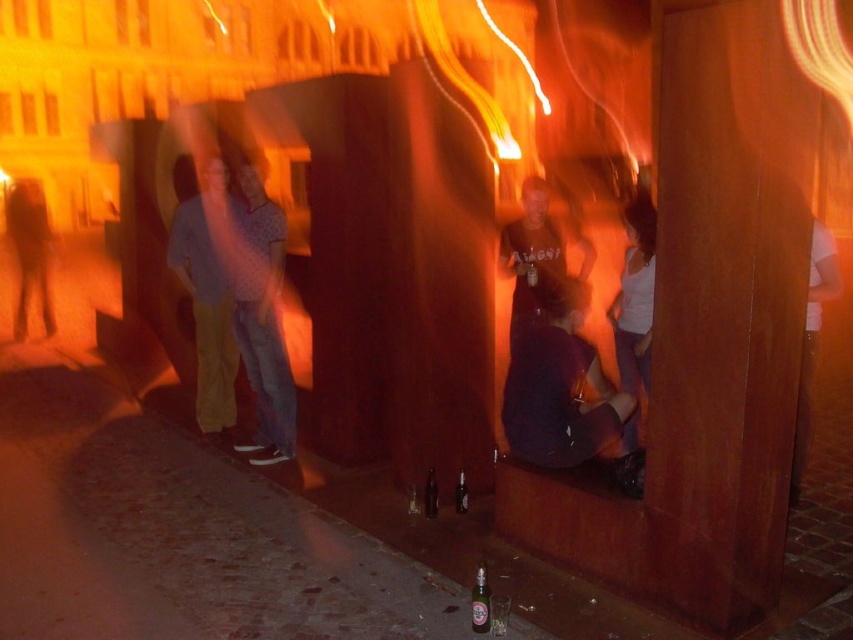
Consider the image. Who is more forward, (x=618, y=358) or (x=430, y=496)?

Point (x=430, y=496)

The image size is (853, 640). What do you see at coordinates (635, 298) in the screenshot? I see `white cotton tank top at center` at bounding box center [635, 298].

Where is `white cotton tank top at center`? Image resolution: width=853 pixels, height=640 pixels. white cotton tank top at center is located at coordinates (635, 298).

Does translucent glass bottle at lower center have a larger size compared to translucent glass bottle at center?

Indeed, translucent glass bottle at lower center has a larger size compared to translucent glass bottle at center.

Which is more to the left, translucent glass bottle at lower center or translucent glass bottle at center?

translucent glass bottle at lower center is more to the left.

I want to click on translucent glass bottle at lower center, so click(430, 493).

Which is in front, point (548, 358) or point (195, 298)?

Point (548, 358) is more forward.

Which of these two, dark purple fabric at center or matte yellow pants at left, stands taller?

Standing taller between the two is matte yellow pants at left.

Which is behind, point (531, 435) or point (213, 388)?

The point (213, 388) is more distant.

Where is `dark purple fabric at center`? This screenshot has width=853, height=640. dark purple fabric at center is located at coordinates pyautogui.click(x=560, y=387).